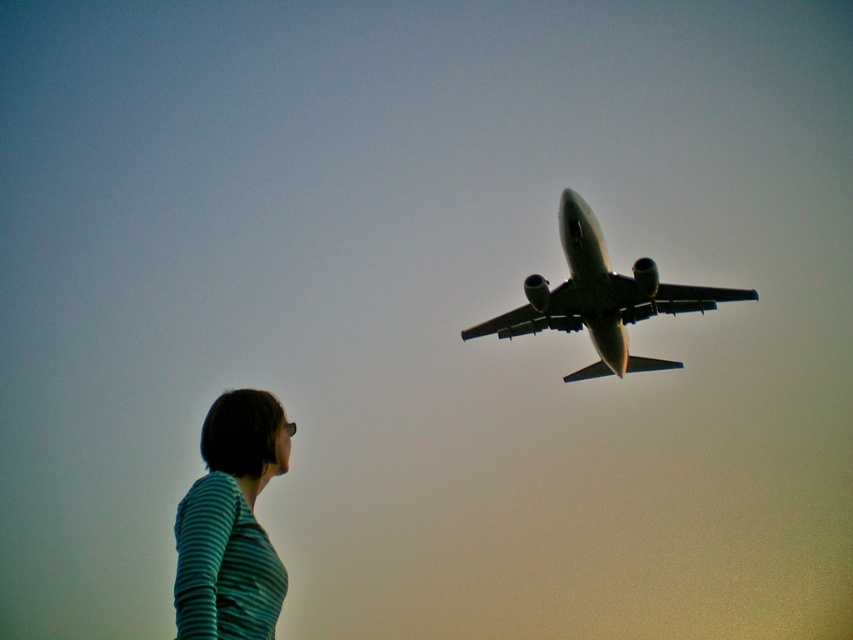
Who is positioned more to the right, teal striped shirt at lower left or metallic gray airplane at upper center?

Positioned to the right is metallic gray airplane at upper center.

Which is in front, point (190, 556) or point (531, 278)?

Point (190, 556) is more forward.

Describe the element at coordinates (231, 524) in the screenshot. I see `teal striped shirt at lower left` at that location.

Identify the location of teal striped shirt at lower left. The height and width of the screenshot is (640, 853). (231, 524).